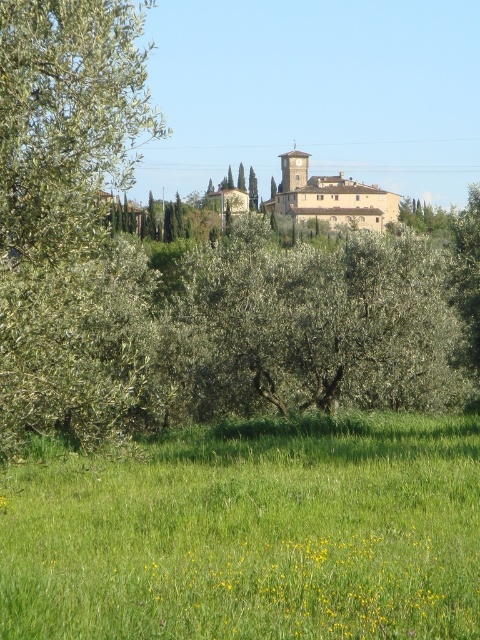
Question: Does green grassy field at lower center appear under green leafy tree at left?

Choices:
 (A) no
 (B) yes

Answer: (B)

Question: Is the position of green grassy field at lower center more distant than that of green leafy tree at left?

Choices:
 (A) no
 (B) yes

Answer: (A)

Question: Considering the relative positions of green grassy field at lower center and green leafy tree at left in the image provided, where is green grassy field at lower center located with respect to green leafy tree at left?

Choices:
 (A) left
 (B) right

Answer: (B)

Question: Which point is farther to the camera?

Choices:
 (A) (74, 353)
 (B) (368, 435)

Answer: (B)

Question: Which of the following is the closest to the observer?

Choices:
 (A) (17, 10)
 (B) (397, 506)

Answer: (A)